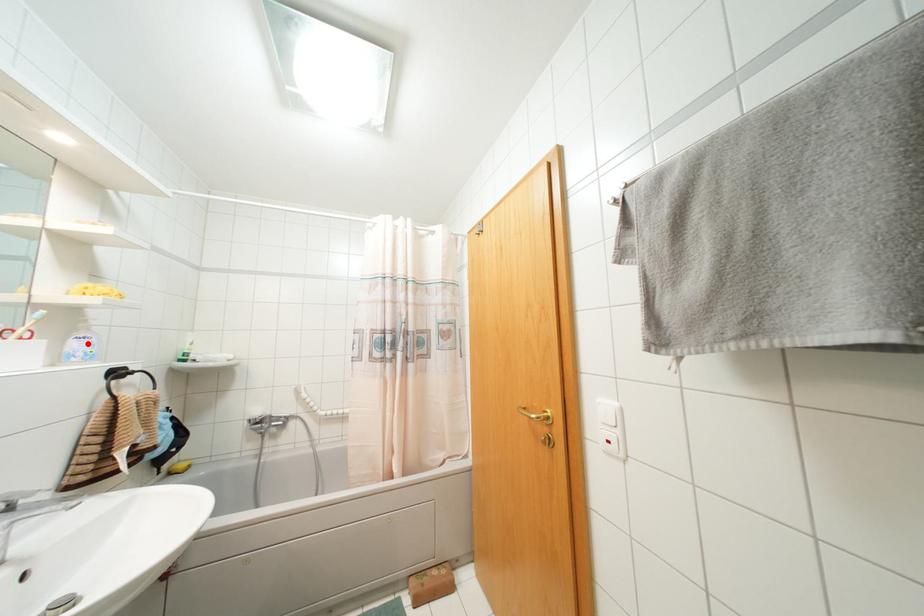
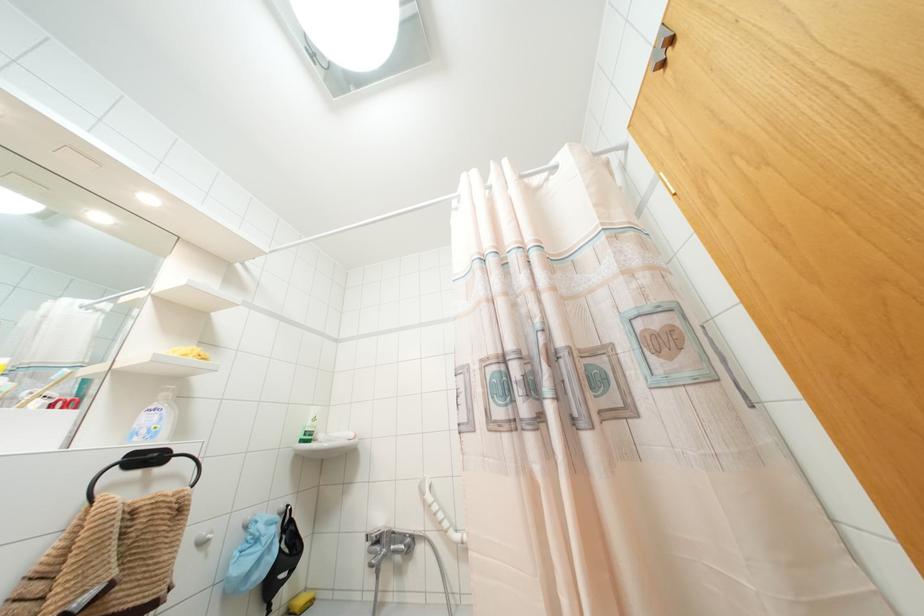
Where in the second image is the point corresponding to the highlighted location from the first image?

(154, 418)